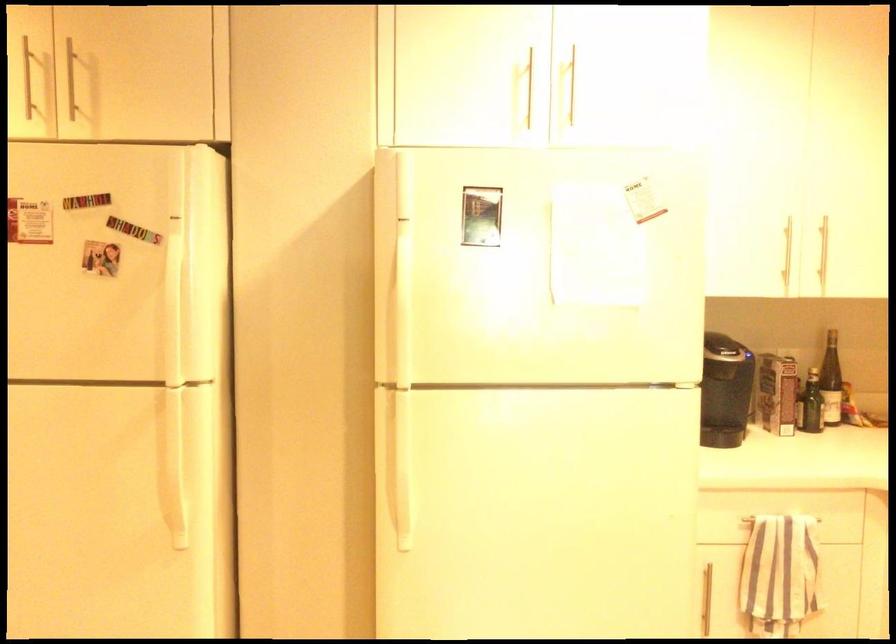
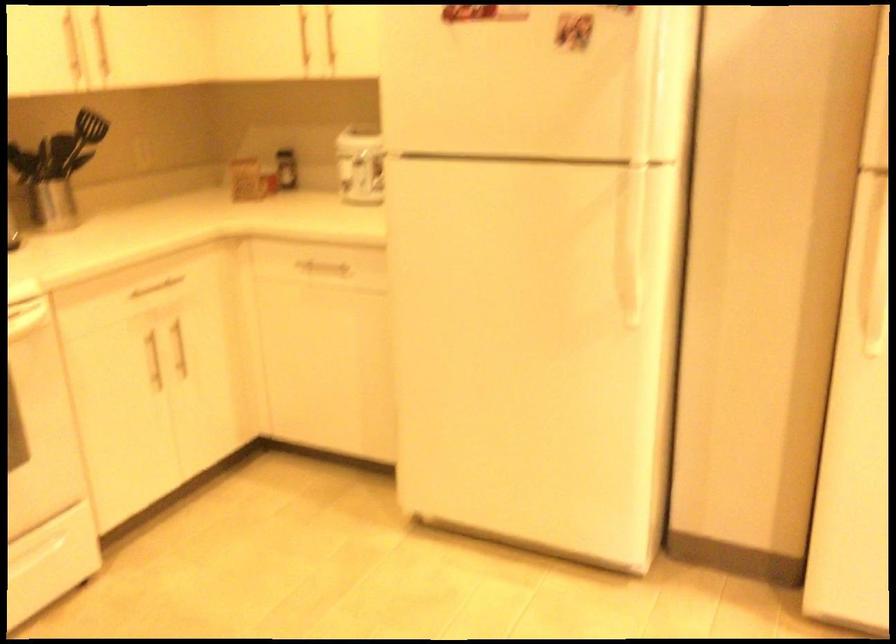
In the second image, find the point that corresponds to [176,325] in the first image.

(642, 104)